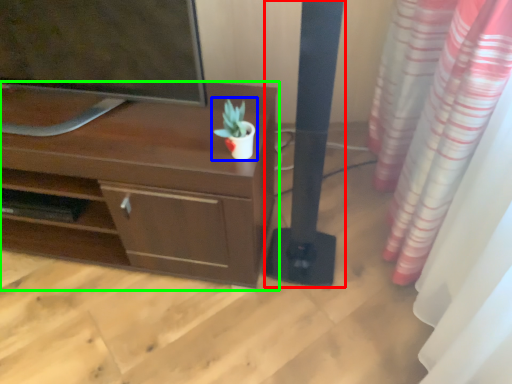
Question: Based on their relative distances, which object is farther from pillar (highlighted by a red box)? Choose from houseplant (highlighted by a blue box) and desk (highlighted by a green box).

Choices:
 (A) houseplant
 (B) desk

Answer: (B)